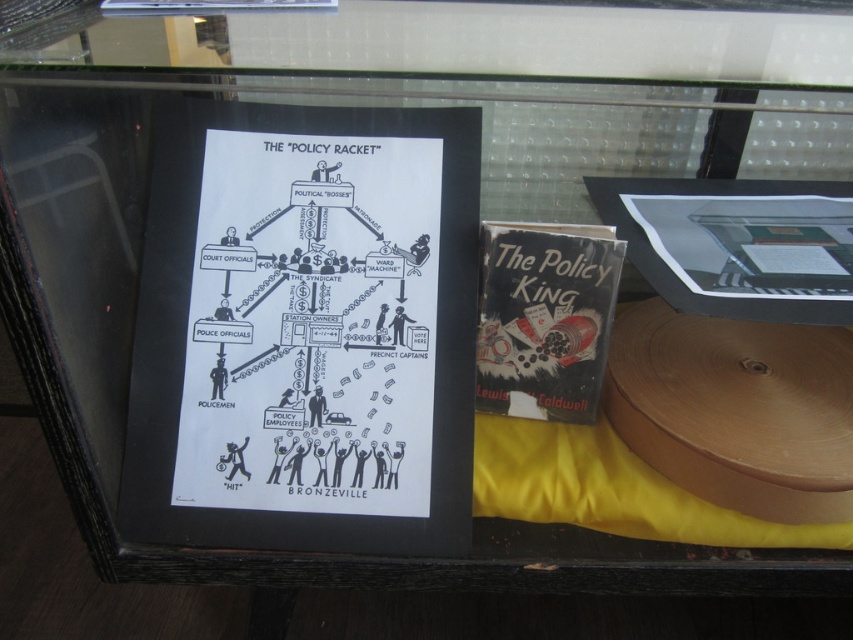
Between black paper poster at center and black paperback book at center, which one is positioned higher?

Positioned higher is black paper poster at center.

Is black paper poster at center wider than black paperback book at center?

Indeed, black paper poster at center has a greater width compared to black paperback book at center.

What do you see at coordinates (311, 324) in the screenshot? I see `black paper poster at center` at bounding box center [311, 324].

Where is `black paper poster at center`? black paper poster at center is located at coordinates (311, 324).

Who is lower down, hardcover book at upper right or black paperback book at center?

black paperback book at center

Who is positioned more to the right, hardcover book at upper right or black paperback book at center?

Positioned to the right is hardcover book at upper right.

Image resolution: width=853 pixels, height=640 pixels. What do you see at coordinates (735, 243) in the screenshot?
I see `hardcover book at upper right` at bounding box center [735, 243].

The image size is (853, 640). What are the coordinates of `hardcover book at upper right` in the screenshot? It's located at (735, 243).

Does black paper poster at center appear on the right side of hardcover book at upper right?

In fact, black paper poster at center is to the left of hardcover book at upper right.

Which is behind, point (323, 216) or point (670, 284)?

Positioned behind is point (323, 216).

Locate an element on the screen. The width and height of the screenshot is (853, 640). black paper poster at center is located at coordinates (311, 324).